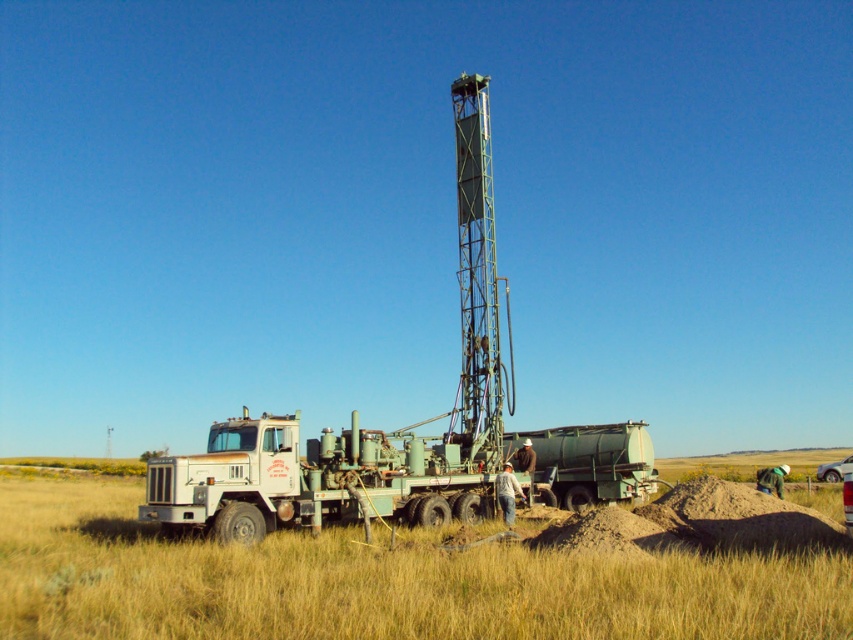
You are standing in front of the truck and want to determine the relative positions of two points marked on the drilling rig. Which point is closer to you, point 1 at coordinates (x=345, y=628) or point 2 at coordinates (x=331, y=472)?

Point 1 at coordinates (x=345, y=628) is closer to you than point 2 at coordinates (x=331, y=472).